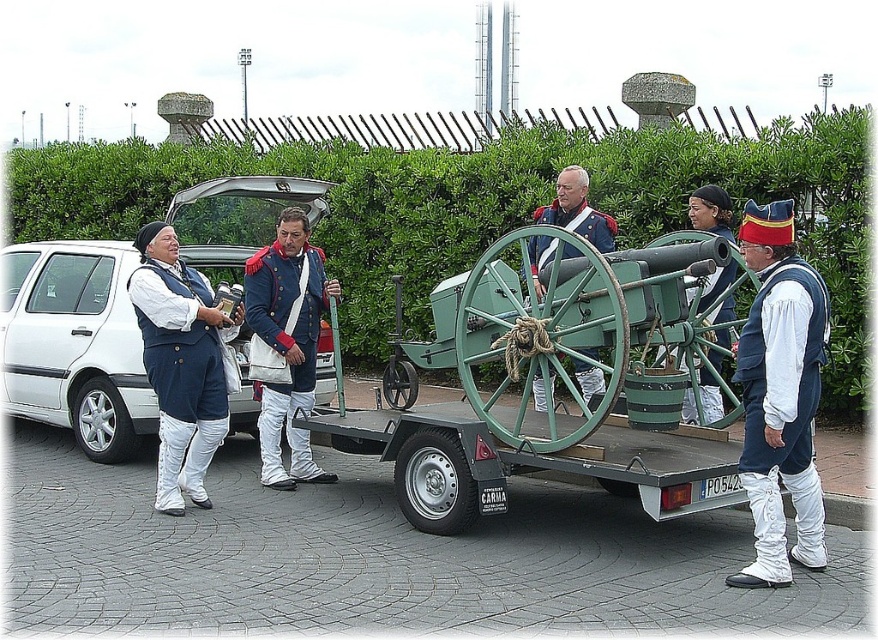
You are a historical reenactor who needs to transport the matte blue vest at left to the green wooden cart at center. Given the spatial relationship between them, can you estimate whether the vest will fit on the cart without needing to adjust its position?

The green wooden cart at center is wider than the matte blue vest at left, so the vest should fit on the cart without needing to adjust its position.

You are a photographer planning to take a group photo of the matte blue uniform at center and the green leafy hedge at upper center. Which object will occupy more space in the photo?

The green leafy hedge at upper center will occupy more space in the photo because it has a larger size compared to the matte blue uniform at center.